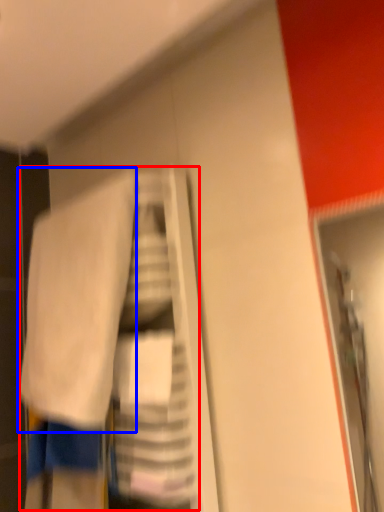
Question: Among these objects, which one is farthest to the camera, laundry (highlighted by a red box) or towel (highlighted by a blue box)?

Choices:
 (A) laundry
 (B) towel

Answer: (B)